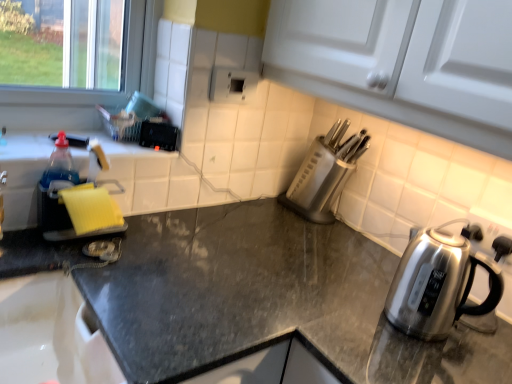
Where is `empty space that is to the right of yellow sponge at left`? This screenshot has width=512, height=384. empty space that is to the right of yellow sponge at left is located at coordinates (154, 247).